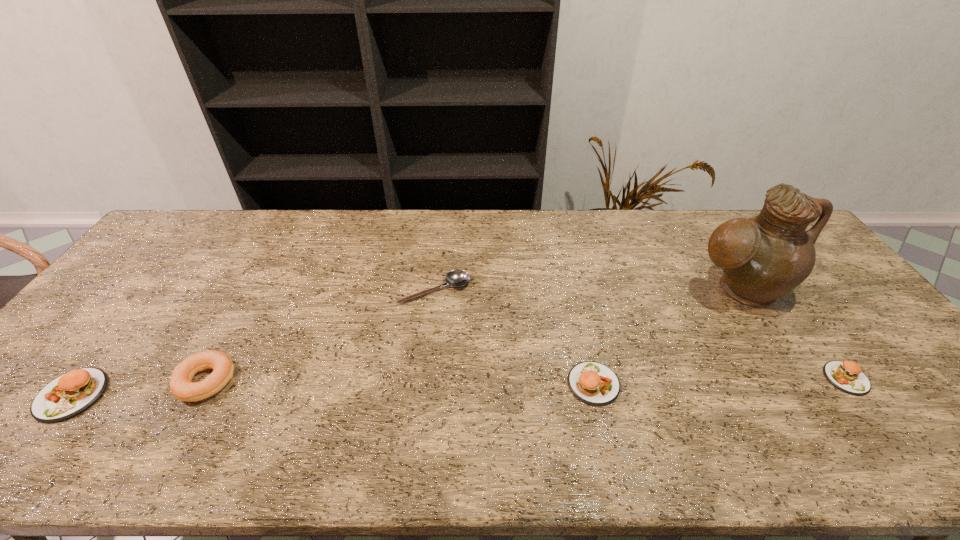
Find the location of a particular element. Image resolution: width=960 pixels, height=540 pixels. vacant space located 0.360m on the right of the leftmost object is located at coordinates (255, 395).

Locate an element on the screen. This screenshot has height=540, width=960. free region located on the left of the second patty from left to right is located at coordinates (423, 384).

Find the location of a particular element. free region located on the left of the shortest patty is located at coordinates (695, 379).

Image resolution: width=960 pixels, height=540 pixels. I want to click on vacant space located at the spout of the pitcher, so pos(782,359).

At what (x,y) coordinates should I click in order to perform the action: click on free space located 0.100m on the back of the second object from left to right. Please return your answer as a coordinate pair (x, y). Looking at the image, I should click on (235, 328).

Identify the location of blank space located on the front of the ladle. The height and width of the screenshot is (540, 960). (432, 321).

Where is `bagel that is at the near edge`? The image size is (960, 540). bagel that is at the near edge is located at coordinates (181, 386).

Identify the location of object that is positioned at the left edge. (66, 396).

You are a GUI agent. You are given a task and a screenshot of the screen. Output one action in this format:
    pyautogui.click(x=<x>, y=<y>)
    Task: Click on the object that is at the right edge
    The width and height of the screenshot is (960, 540).
    Given the screenshot: What is the action you would take?
    pyautogui.click(x=847, y=376)

Identify the location of object that is positioned at the near left corner. This screenshot has width=960, height=540. (66, 396).